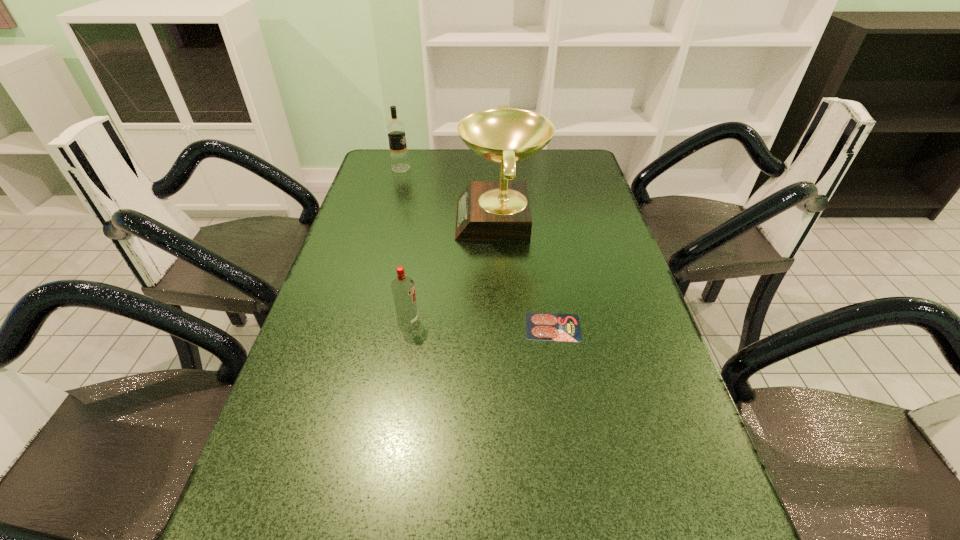
Find the location of `the tallest object`. the tallest object is located at coordinates (486, 210).

The width and height of the screenshot is (960, 540). What are the coordinates of `award` in the screenshot? It's located at (486, 210).

Find the location of `the taller vodka`. the taller vodka is located at coordinates (395, 129).

This screenshot has height=540, width=960. I want to click on the farthest object, so click(395, 129).

Find the location of a particular element. The image size is (960, 540). the second object from left to right is located at coordinates (403, 289).

The height and width of the screenshot is (540, 960). I want to click on the right vodka, so click(x=403, y=289).

Where is `salami`? The height and width of the screenshot is (540, 960). salami is located at coordinates (539, 326).

This screenshot has height=540, width=960. What are the coordinates of `vacant space positioned on the front-facing side of the tallest object` in the screenshot? It's located at (377, 219).

This screenshot has height=540, width=960. In order to click on vacant position located on the front-facing side of the tallest object in this screenshot , I will do `click(387, 219)`.

Identify the location of free space located on the front-facing side of the tallest object. The width and height of the screenshot is (960, 540). (380, 219).